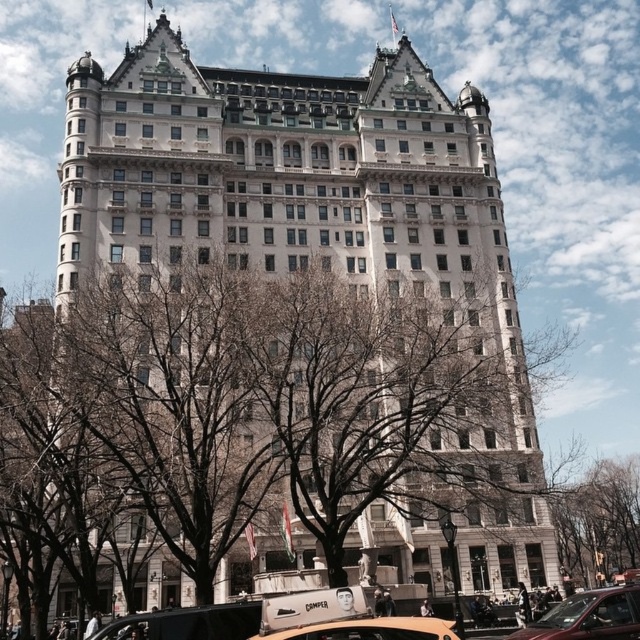
Question: Does bare branches at center appear on the left side of metallic gold taxi at lower center?

Choices:
 (A) no
 (B) yes

Answer: (A)

Question: Which of the following is the closest to the observer?

Choices:
 (A) (554, 504)
 (B) (376, 627)
 (C) (612, 611)

Answer: (B)

Question: Estimate the real-world distances between objects in this image. Which object is closer to the metallic gold taxi at lower center?

Choices:
 (A) metallic red car at lower right
 (B) bare branches at center

Answer: (A)

Question: Which of the following is the closest to the observer?

Choices:
 (A) bare branches at center
 (B) metallic gold taxi at lower center

Answer: (B)

Question: From the image, what is the correct spatial relationship of metallic red car at lower right in relation to metallic gold taxi at lower center?

Choices:
 (A) below
 (B) above

Answer: (B)

Question: Does bare branches at center come behind metallic gold taxi at lower center?

Choices:
 (A) yes
 (B) no

Answer: (A)